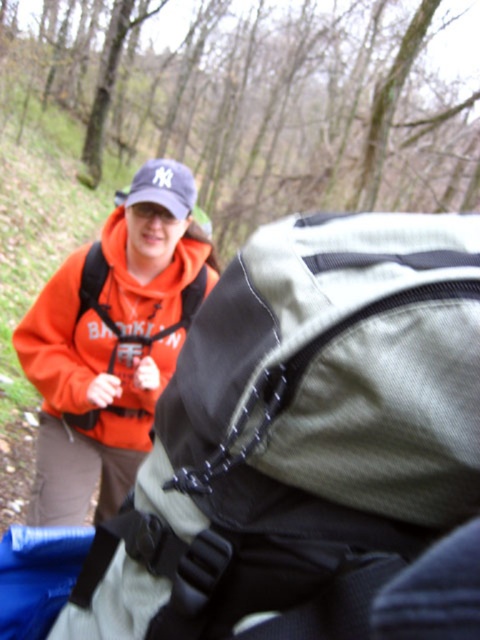
You are a hiker planning to walk through the forest. You see the gray fabric backpack at center and the orange fleece jacket at center in your path. If your stride length is 0.75 meters, how many steps do you need to take to pass both items?

The distance between the gray fabric backpack at center and the orange fleece jacket at center is 1.31 meters. To pass both items, you would need to cover this distance. Since each step is 0.75 meters, dividing 1.31 by 0.75 gives approximately 1.75 steps. Since you can only take whole steps, you would need to take 2 steps to pass both items.

You are standing in a forest area and want to place two markers at the coordinates point (272, 244) and point (94, 320). Which marker should you place first if you want to start closer to your current position?

You should place the marker at point (272, 244) first because it is closer to the viewer than point (94, 320).

You are planning to take a photo of the person wearing the orange fleece jacket at center and the gray fabric backpack at center. If you want to ensure both items are fully visible in the frame, which item should you focus on to avoid cropping due to their size difference?

Since the gray fabric backpack at center has a lesser width compared to the orange fleece jacket at center, you should focus on the orange fleece jacket at center to ensure it fits entirely within the frame without being cropped.